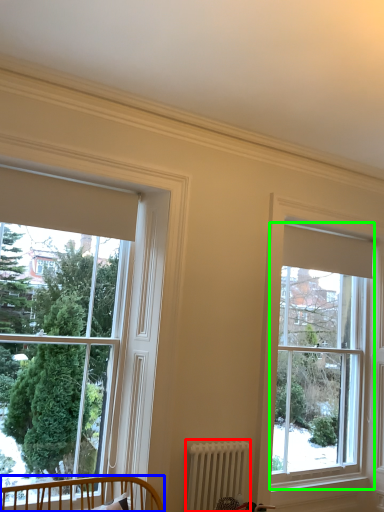
Question: Which object is the farthest from radiator (highlighted by a red box)? Choose among these: furniture (highlighted by a blue box) or window (highlighted by a green box).

Choices:
 (A) furniture
 (B) window

Answer: (B)